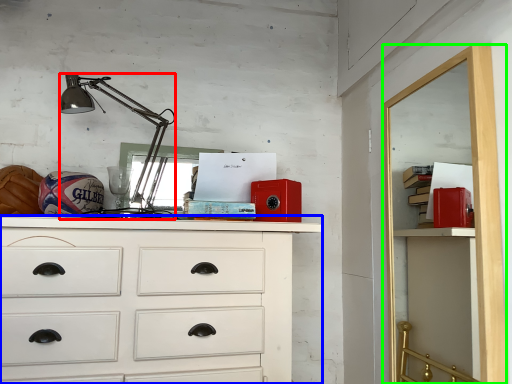
Question: Which object is positioned farthest from lamp (highlighted by a red box)? Select from chest of drawers (highlighted by a blue box) and file cabinet (highlighted by a green box).

Choices:
 (A) chest of drawers
 (B) file cabinet

Answer: (B)